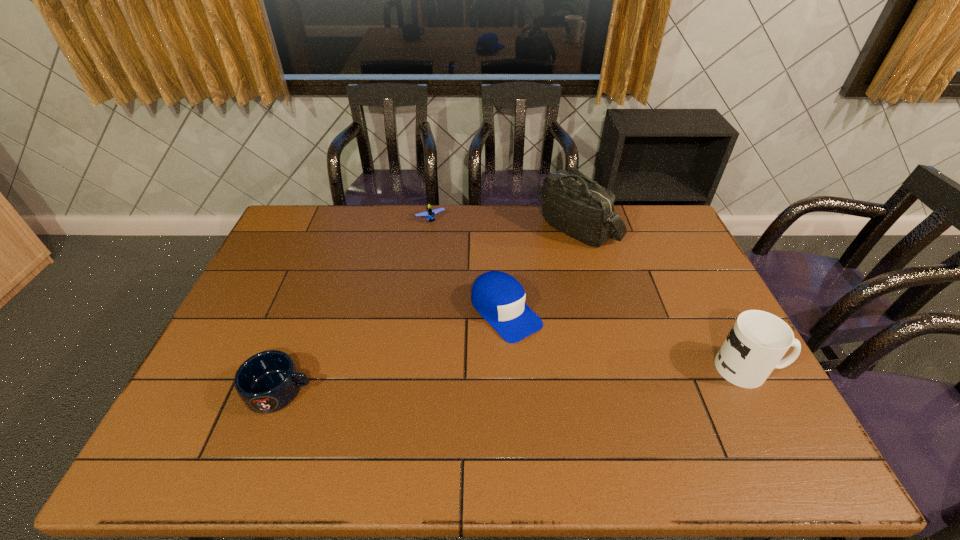
You are a GUI agent. You are given a task and a screenshot of the screen. Output one action in this format:
    pyautogui.click(x=<x>, y=<y>)
    Task: Click on the vacant space that is in between the fourth object from right to left and the second shortest object
    The image size is (960, 540).
    Given the screenshot: What is the action you would take?
    pyautogui.click(x=355, y=305)

This screenshot has width=960, height=540. I want to click on empty location between the shorter mug and the tallest object, so click(x=429, y=309).

The image size is (960, 540). What are the coordinates of `object that is the second closest to the shortest object` in the screenshot? It's located at (572, 203).

Point out which object is positioned as the nearest to the second object from left to right. Please provide its 2D coordinates. Your answer should be formatted as a tuple, i.e. [(x, y)], where the tuple contains the x and y coordinates of a point satisfying the conditions above.

[(499, 298)]

In order to click on vacant space that satisfies the following two spatial constraints: 1. on the front side of the Lego; 2. on the left side of the baseball cap in this screenshot , I will do `click(418, 312)`.

The width and height of the screenshot is (960, 540). Find the location of `vacant point that satisfies the following two spatial constraints: 1. on the front side of the shoulder bag; 2. on the right side of the fourth object from right to left`. vacant point that satisfies the following two spatial constraints: 1. on the front side of the shoulder bag; 2. on the right side of the fourth object from right to left is located at coordinates (429, 228).

Where is `vacant area that satisfies the following two spatial constraints: 1. on the front side of the third shortest object; 2. on the handle side of the right mug`? The width and height of the screenshot is (960, 540). vacant area that satisfies the following two spatial constraints: 1. on the front side of the third shortest object; 2. on the handle side of the right mug is located at coordinates (510, 368).